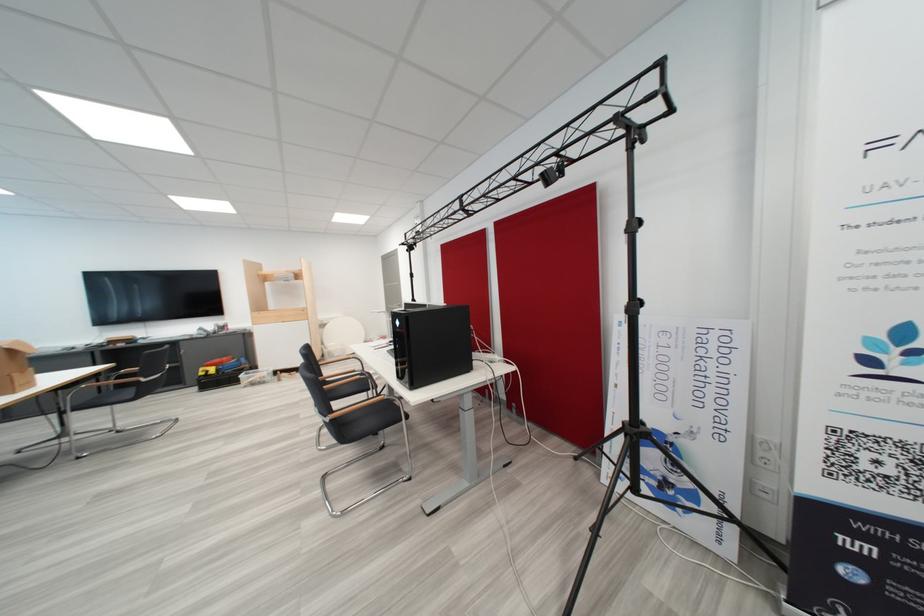
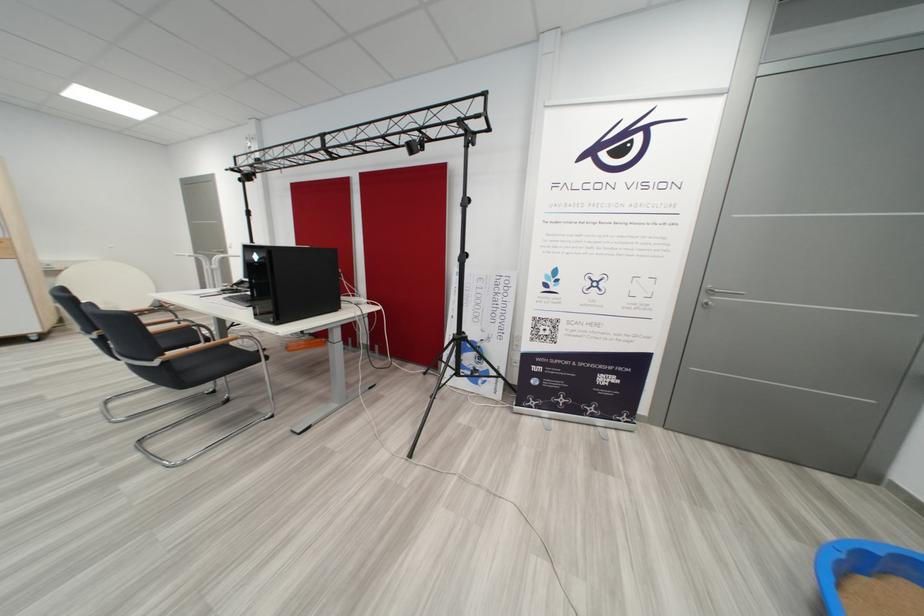
Question: The camera is either moving clockwise (left) or counter-clockwise (right) around the object. The first image is from the beginning of the video and the second image is from the end. Is the camera moving left or right when shooting the video?

Choices:
 (A) Left
 (B) Right

Answer: (A)